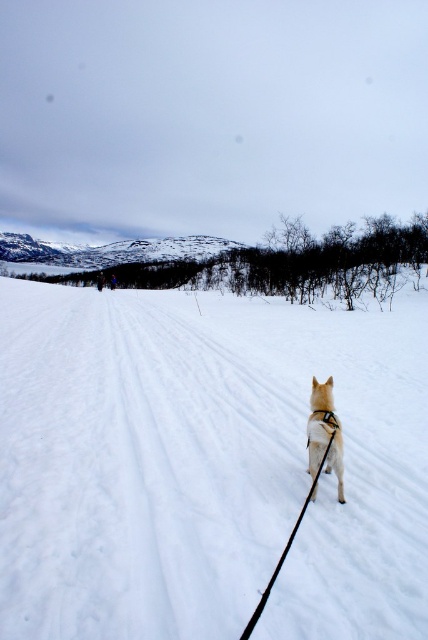
You are a photographer trying to capture the white fur dog at center and the white fluffy snow at center in the same frame. Since both are white, how can you distinguish them in your photo?

The white fluffy snow at center is positioned on the right side of the white fur dog at center, so you can distinguish them by noting the white fluffy snow at center is located to the right of the white fur dog at center.

You are a hiker lost in the winter landscape shown. You see a point marked at coordinates (207,467). Where is this point located in relation to the snow?

The point at (207,467) is on the white fluffy snow at center.

You are an observer standing in the winter landscape scene. You see the white fluffy snow at center and the white fur dog at center. Which object is wider?

The white fluffy snow at center is wider than the white fur dog at center.